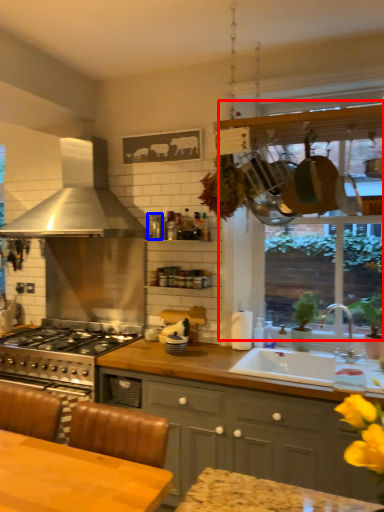
Question: Which object appears farthest to the camera in this image, window frame (highlighted by a red box) or appliance (highlighted by a blue box)?

Choices:
 (A) window frame
 (B) appliance

Answer: (B)